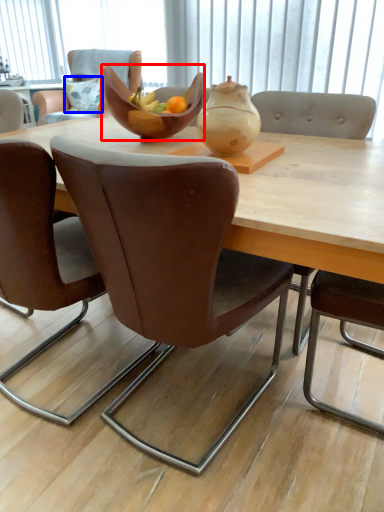
Question: Among these objects, which one is nearest to the camera, bowl (highlighted by a red box) or pillow (highlighted by a blue box)?

Choices:
 (A) bowl
 (B) pillow

Answer: (A)